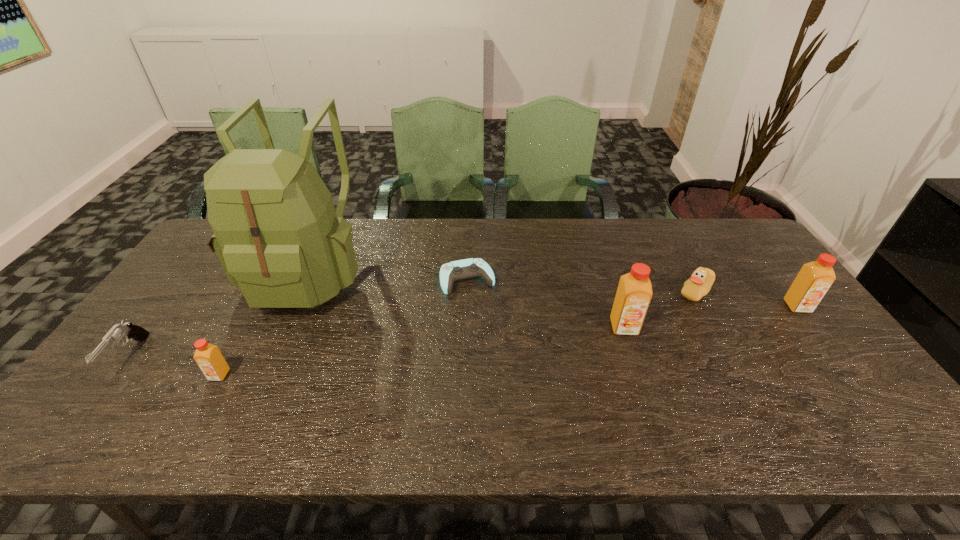
I want to click on object that can be found as the third closest to the shortest object, so click(x=699, y=284).

Where is `orange juice that is the second closest to the shortest object`? The width and height of the screenshot is (960, 540). orange juice that is the second closest to the shortest object is located at coordinates (208, 357).

I want to click on orange juice that stands as the second closest to the fifth object from left to right, so click(x=208, y=357).

Image resolution: width=960 pixels, height=540 pixels. Find the location of `blank area in the image that satisfies the following two spatial constraints: 1. at the beak of the sixth object from left to right; 2. on the front and back of the second nearest orange juice`. blank area in the image that satisfies the following two spatial constraints: 1. at the beak of the sixth object from left to right; 2. on the front and back of the second nearest orange juice is located at coordinates (714, 327).

The width and height of the screenshot is (960, 540). Identify the location of free space that satisfies the following two spatial constraints: 1. at the beak of the sixth object from left to right; 2. on the front and back of the leftmost orange juice. (740, 375).